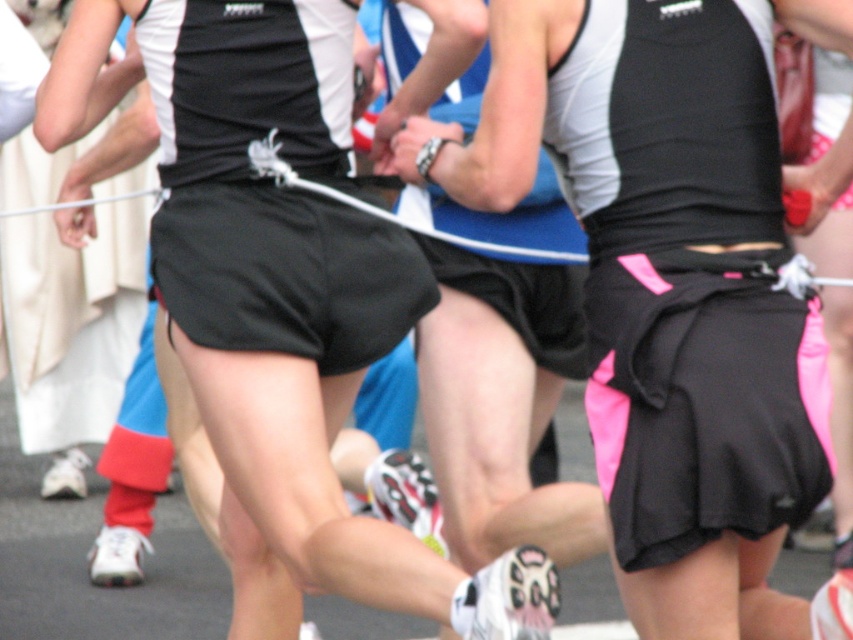
You are a photographer trying to capture the best shot of the runners. You notice the black matte shorts at center and the black matte skirt at center. Which of these two items would appear bigger in your photo?

The black matte shorts at center would appear bigger in the photo since it has a larger size compared to the black matte skirt at center.

You are a photographer trying to capture the height difference between the black matte shorts at center and the black matte skirt at center. Which one should you focus on to show the height difference clearly?

The black matte shorts at center has a greater height compared to the black matte skirt at center, so focusing on the black matte shorts at center would best highlight the height difference.